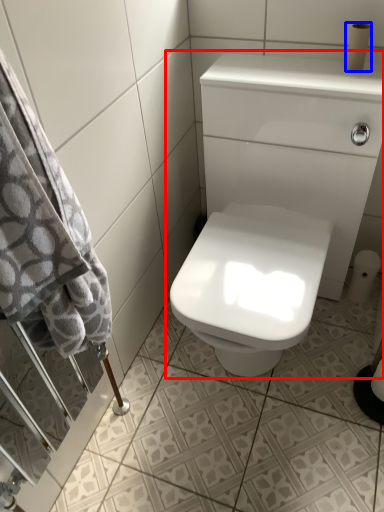
Question: Which of the following is the closest to the observer, sink (highlighted by a red box) or toilet paper (highlighted by a blue box)?

Choices:
 (A) sink
 (B) toilet paper

Answer: (A)